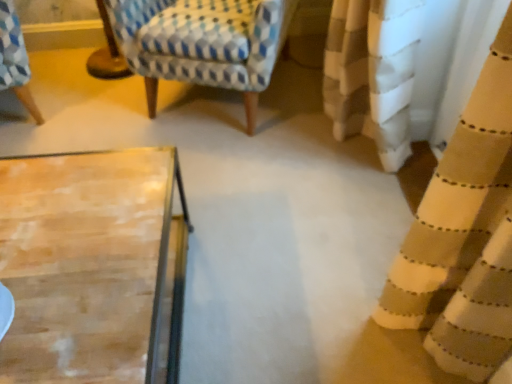
In order to face beige textured curtain at right, should I rotate leftwards or rightwards?

You should look right and rotate roughly 27.855 degrees.

What do you see at coordinates (464, 236) in the screenshot? I see `beige textured curtain at right` at bounding box center [464, 236].

This screenshot has width=512, height=384. I want to click on beige textured curtain at right, so click(x=464, y=236).

Measure the distance between patterned fabric rocking chair at upper left and camera.

patterned fabric rocking chair at upper left and camera are 1.59 meters apart.

What do you see at coordinates (202, 43) in the screenshot? The image size is (512, 384). I see `patterned fabric rocking chair at upper left` at bounding box center [202, 43].

Locate an element on the screen. patterned fabric rocking chair at upper left is located at coordinates (202, 43).

The height and width of the screenshot is (384, 512). In order to click on beige textured curtain at right in this screenshot , I will do `click(464, 236)`.

Considering the relative positions of beige textured curtain at right and patterned fabric rocking chair at upper left in the image provided, is beige textured curtain at right to the right of patterned fabric rocking chair at upper left from the viewer's perspective?

Yes.

In the scene shown: Who is more distant, beige textured curtain at right or patterned fabric rocking chair at upper left?

Positioned behind is patterned fabric rocking chair at upper left.

Which is in front, point (395, 317) or point (169, 78)?

The point (395, 317) is closer to the camera.

From the image's perspective, is beige textured curtain at right over patterned fabric rocking chair at upper left?

Actually, beige textured curtain at right appears below patterned fabric rocking chair at upper left in the image.

From a real-world perspective, which is physically above, beige textured curtain at right or patterned fabric rocking chair at upper left?

beige textured curtain at right.

Can you confirm if beige textured curtain at right is wider than patterned fabric rocking chair at upper left?

Incorrect, the width of beige textured curtain at right does not surpass that of patterned fabric rocking chair at upper left.

Does beige textured curtain at right have a lesser height compared to patterned fabric rocking chair at upper left?

In fact, beige textured curtain at right may be taller than patterned fabric rocking chair at upper left.

Considering the sizes of objects beige textured curtain at right and patterned fabric rocking chair at upper left in the image provided, who is smaller, beige textured curtain at right or patterned fabric rocking chair at upper left?

With smaller size is beige textured curtain at right.

Is beige textured curtain at right inside the boundaries of patterned fabric rocking chair at upper left, or outside?

The correct answer is: outside.

Is beige textured curtain at right positioned far away from patterned fabric rocking chair at upper left?

beige textured curtain at right is far away from patterned fabric rocking chair at upper left.

Is beige textured curtain at right oriented towards patterned fabric rocking chair at upper left?

No, beige textured curtain at right is not oriented towards patterned fabric rocking chair at upper left.

How much distance is there between beige textured curtain at right and patterned fabric rocking chair at upper left?

The distance of beige textured curtain at right from patterned fabric rocking chair at upper left is 3.79 feet.

The image size is (512, 384). In the image, there is a beige textured curtain at right. Find the location of `rocking chair below it (from a real-world perspective)`. rocking chair below it (from a real-world perspective) is located at coordinates tap(202, 43).

Can you confirm if patterned fabric rocking chair at upper left is positioned to the right of beige textured curtain at right?

No, patterned fabric rocking chair at upper left is not to the right of beige textured curtain at right.

Is patterned fabric rocking chair at upper left in front of or behind beige textured curtain at right in the image?

patterned fabric rocking chair at upper left is behind beige textured curtain at right.

Which point is more distant from viewer, (200,60) or (495,244)?

The point (200,60) is farther from the camera.

From the image's perspective, is patterned fabric rocking chair at upper left above or below beige textured curtain at right?

Clearly, from the image's perspective, patterned fabric rocking chair at upper left is above beige textured curtain at right.

From a real-world perspective, is patterned fabric rocking chair at upper left above or below beige textured curtain at right?

patterned fabric rocking chair at upper left is below beige textured curtain at right.

In terms of width, does patterned fabric rocking chair at upper left look wider or thinner when compared to beige textured curtain at right?

Clearly, patterned fabric rocking chair at upper left has more width compared to beige textured curtain at right.

Can you confirm if patterned fabric rocking chair at upper left is shorter than beige textured curtain at right?

Indeed, patterned fabric rocking chair at upper left has a lesser height compared to beige textured curtain at right.

Considering the sizes of objects patterned fabric rocking chair at upper left and beige textured curtain at right in the image provided, who is bigger, patterned fabric rocking chair at upper left or beige textured curtain at right?

patterned fabric rocking chair at upper left.

Is patterned fabric rocking chair at upper left located outside beige textured curtain at right?

patterned fabric rocking chair at upper left is positioned outside beige textured curtain at right.

Is patterned fabric rocking chair at upper left not close to beige textured curtain at right?

Yes.

Is beige textured curtain at right at the back of patterned fabric rocking chair at upper left?

No, beige textured curtain at right is not at the back of patterned fabric rocking chair at upper left.

At what (x,y) coordinates should I click in order to perform the action: click on rocking chair that appears above the beige textured curtain at right (from the image's perspective). Please return your answer as a coordinate pair (x, y). Looking at the image, I should click on (202, 43).

Find the location of a particular element. rocking chair that appears above the beige textured curtain at right (from the image's perspective) is located at coordinates click(x=202, y=43).

Where is `rocking chair behind the beige textured curtain at right`? rocking chair behind the beige textured curtain at right is located at coordinates (202, 43).